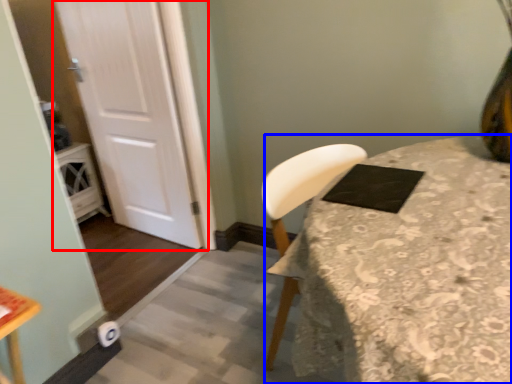
Question: Which object appears closest to the camera in this image, door (highlighted by a red box) or table (highlighted by a blue box)?

Choices:
 (A) door
 (B) table

Answer: (B)